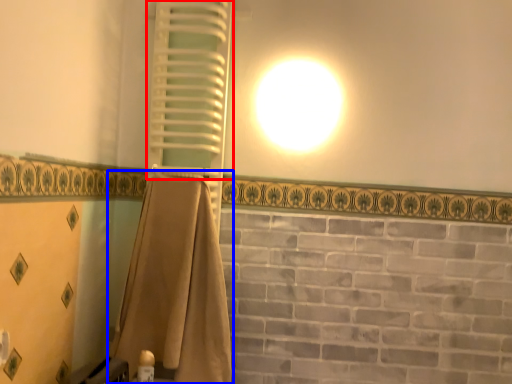
Question: Which point is further to the camera, shutter (highlighted by a red box) or curtain (highlighted by a blue box)?

Choices:
 (A) shutter
 (B) curtain

Answer: (A)